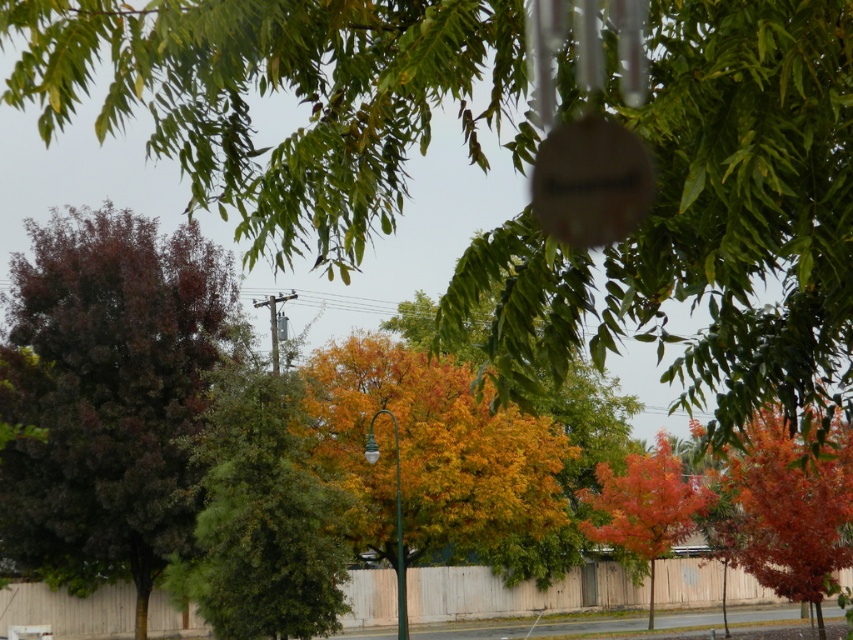
Which of these two, green leafy tree at upper center or orange glossy tree at center, stands shorter?

Standing shorter between the two is green leafy tree at upper center.

Locate an element on the screen. green leafy tree at upper center is located at coordinates (706, 221).

Locate an element on the screen. dark purple foliage at left is located at coordinates (107, 396).

Is dark purple foliage at left smaller than orange glossy tree at center?

Actually, dark purple foliage at left might be larger than orange glossy tree at center.

Locate an element on the screen. dark purple foliage at left is located at coordinates (107, 396).

Is orange leafy tree at right behind orange glossy tree at center?

No, it is in front of orange glossy tree at center.

Is point (846, 472) less distant than point (648, 480)?

Yes, it is in front of point (648, 480).

Identify the location of orange leafy tree at right. (788, 508).